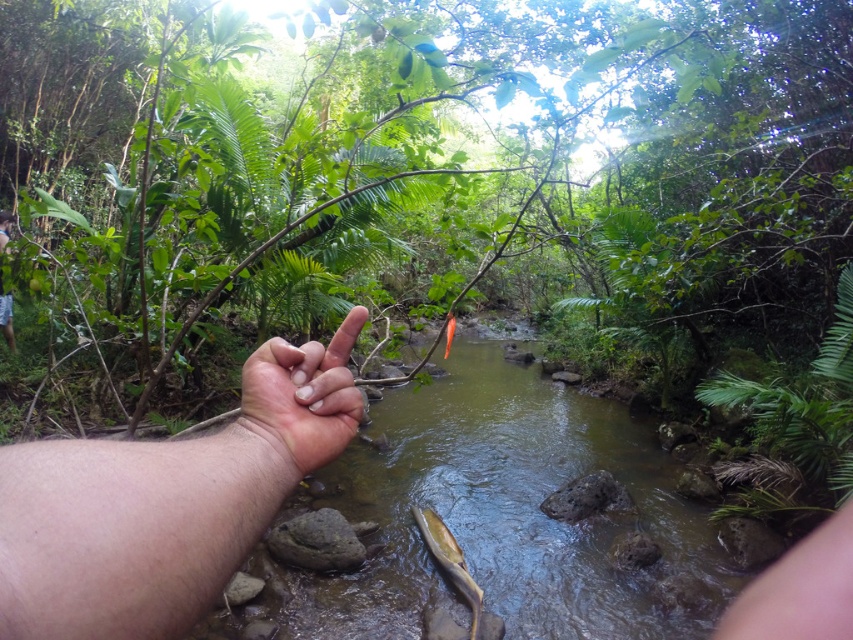
Does clear water at stream center have a smaller size compared to skinny flesh at center?

Yes.

Is the position of clear water at stream center less distant than that of skinny flesh at center?

No, it is not.

Between point (701, 534) and point (83, 608), which one is positioned in front?

Point (83, 608) is more forward.

I want to click on clear water at stream center, so click(x=506, y=515).

Between point (135, 452) and point (0, 216), which one is positioned in front?

Point (135, 452) is more forward.

This screenshot has height=640, width=853. Describe the element at coordinates (164, 502) in the screenshot. I see `skinny flesh at center` at that location.

Image resolution: width=853 pixels, height=640 pixels. Identify the location of skinny flesh at center. (164, 502).

How far apart are skinny flesh at center and shiny golden fish at center?

A distance of 3.10 meters exists between skinny flesh at center and shiny golden fish at center.

Is skinny flesh at center taller than shiny golden fish at center?

Incorrect, skinny flesh at center's height is not larger of shiny golden fish at center's.

Measure the distance between point (x=207, y=484) and camera.

They are 10.09 inches apart.

Identify the location of skinny flesh at center. The image size is (853, 640). (164, 502).